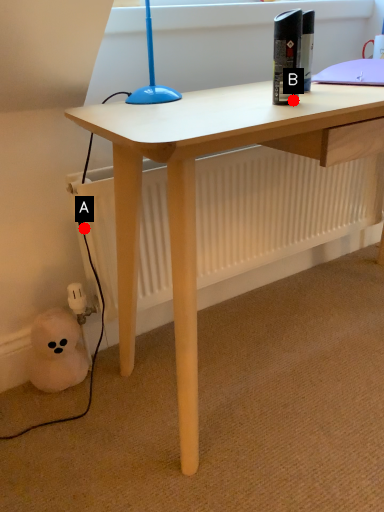
Question: Two points are circled on the image, labeled by A and B beside each circle. Which point is closer to the camera?

Choices:
 (A) A is closer
 (B) B is closer

Answer: (B)